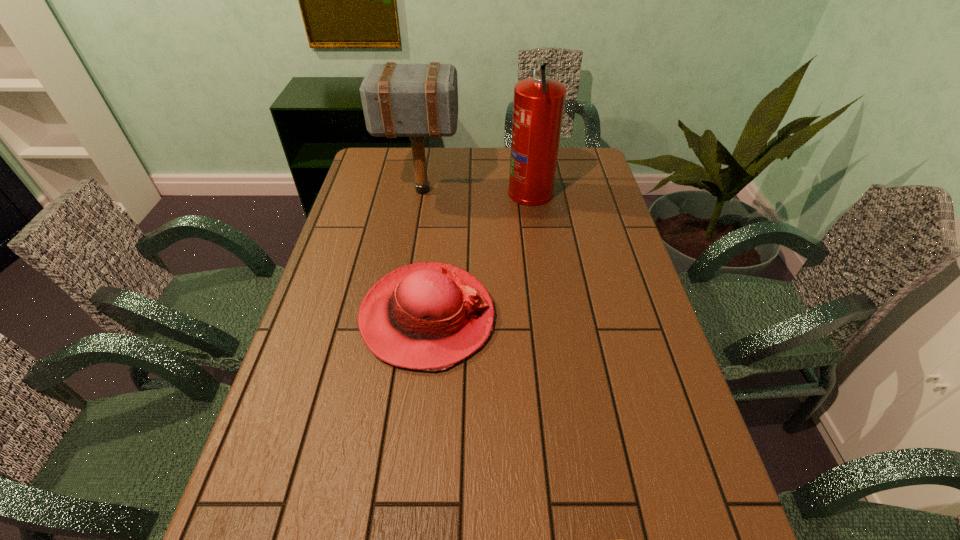
Find the location of `mallet at the far edge`. mallet at the far edge is located at coordinates (399, 100).

You are a GUI agent. You are given a task and a screenshot of the screen. Output one action in this format:
    pyautogui.click(x=<x>, y=<y>)
    Task: Click on the mallet at the left edge
    The height and width of the screenshot is (540, 960).
    Given the screenshot: What is the action you would take?
    pyautogui.click(x=399, y=100)

At what (x,y) coordinates should I click in order to perform the action: click on hat located in the left edge section of the desktop. Please return your answer as a coordinate pair (x, y). Looking at the image, I should click on (429, 316).

Image resolution: width=960 pixels, height=540 pixels. I want to click on object at the far left corner, so click(x=399, y=100).

I want to click on vacant space at the far edge, so click(x=465, y=173).

At what (x,y) coordinates should I click in order to perform the action: click on vacant region at the left edge. Please return your answer as a coordinate pair (x, y). Looking at the image, I should click on (316, 350).

Where is `vacant space at the right edge`? This screenshot has width=960, height=540. vacant space at the right edge is located at coordinates (586, 191).

I want to click on vacant space at the far left corner of the desktop, so click(x=358, y=171).

At what (x,y) coordinates should I click in order to perform the action: click on free space at the far right corner. Please return your answer as a coordinate pair (x, y). Image resolution: width=960 pixels, height=540 pixels. Looking at the image, I should click on (575, 148).

The image size is (960, 540). I want to click on vacant area between the fire extinguisher and the hat, so click(x=479, y=254).